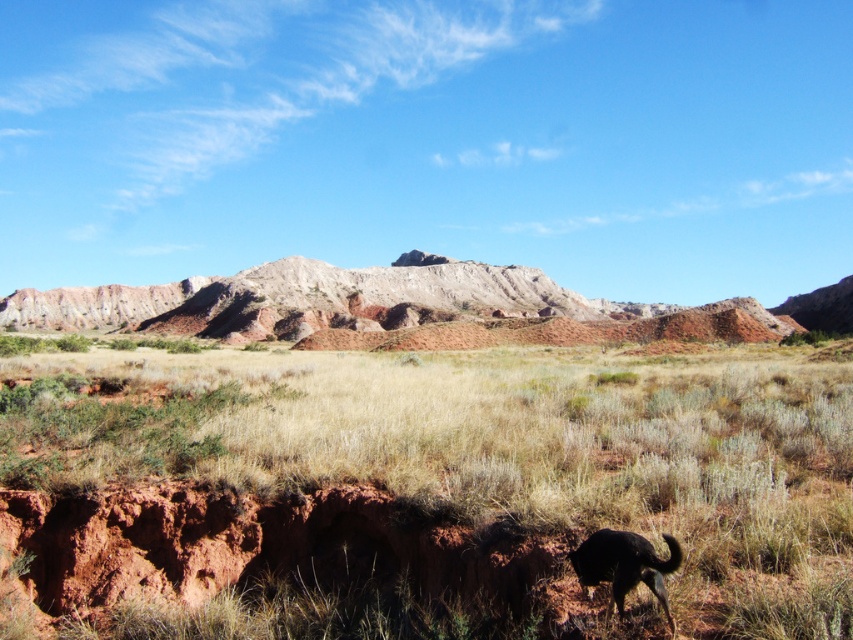
Question: Among these objects, which one is farthest from the camera?

Choices:
 (A) black fur dog at lower right
 (B) rustic sandstone mountain at center

Answer: (B)

Question: In this image, where is brown dirt at center located relative to black fur dog at lower right?

Choices:
 (A) above
 (B) below

Answer: (A)

Question: Which point is farther to the camera?

Choices:
 (A) rustic sandstone mountain at center
 (B) brown dirt at center
 (C) black fur dog at lower right

Answer: (A)

Question: Is brown dirt at center smaller than rustic sandstone mountain at center?

Choices:
 (A) no
 (B) yes

Answer: (B)

Question: Is brown dirt at center thinner than black fur dog at lower right?

Choices:
 (A) no
 (B) yes

Answer: (A)

Question: Based on their relative distances, which object is farther from the rustic sandstone mountain at center?

Choices:
 (A) black fur dog at lower right
 (B) brown dirt at center

Answer: (A)